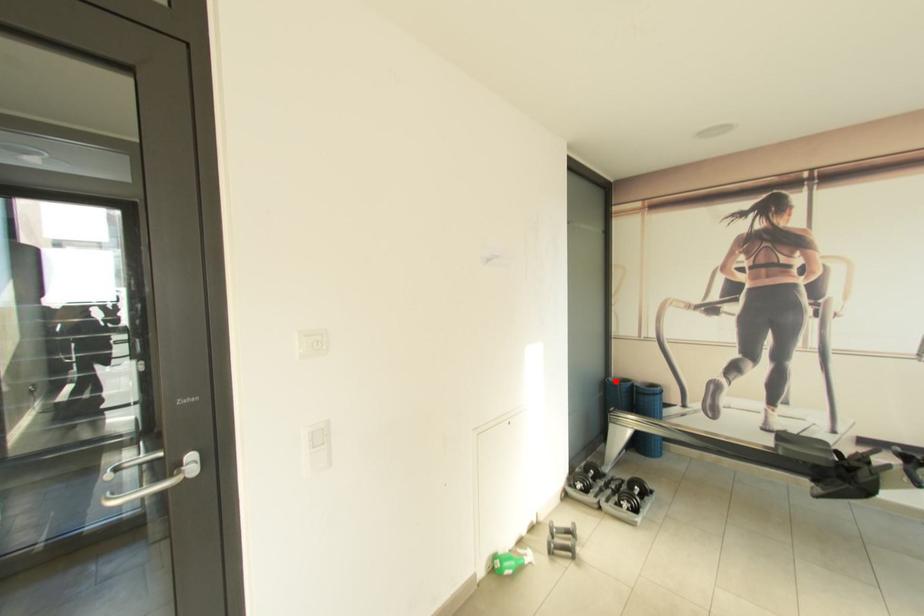
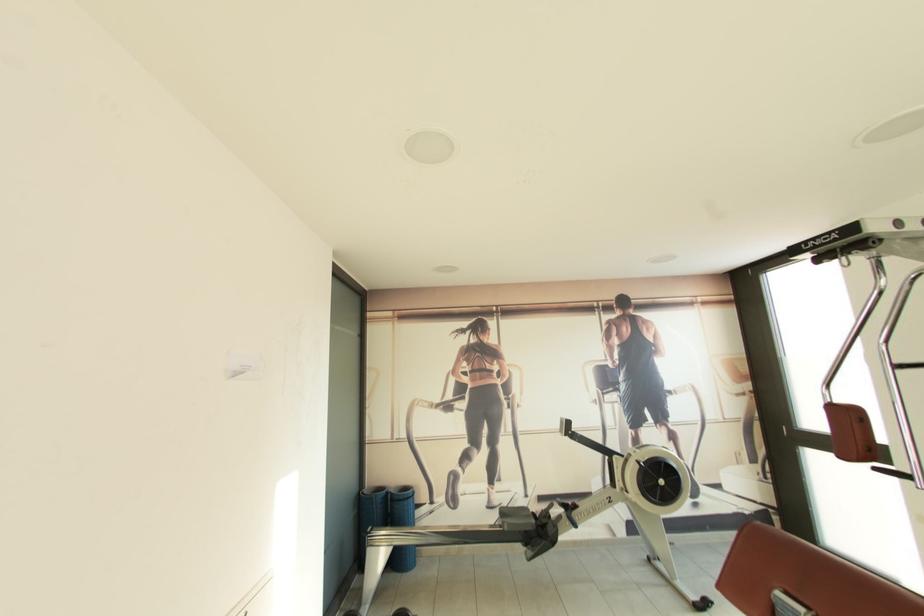
Find the pixel in the second image that matches the highlighted location in the first image.

(371, 493)